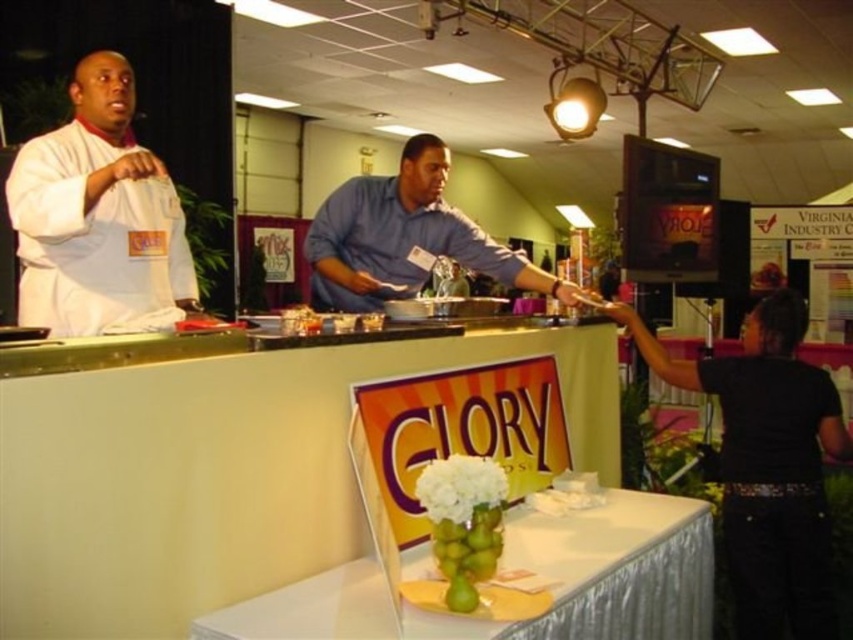
Question: Among these objects, which one is farthest from the camera?

Choices:
 (A) blue cotton shirt at center
 (B) green glass vase at center

Answer: (A)

Question: Does green glass vase at center have a smaller size compared to white chef coat at left?

Choices:
 (A) no
 (B) yes

Answer: (A)

Question: In this image, where is white chef coat at left located relative to blue cotton shirt at center?

Choices:
 (A) below
 (B) above

Answer: (B)

Question: Which of the following is the farthest from the observer?

Choices:
 (A) (38, 225)
 (B) (688, 600)
 (C) (427, 221)
 (D) (799, 627)

Answer: (C)

Question: Which object is closer to the camera taking this photo?

Choices:
 (A) black fabric shirt at right
 (B) blue cotton shirt at center

Answer: (A)

Question: Observing the image, what is the correct spatial positioning of green glass vase at center in reference to black fabric shirt at right?

Choices:
 (A) above
 (B) below

Answer: (B)